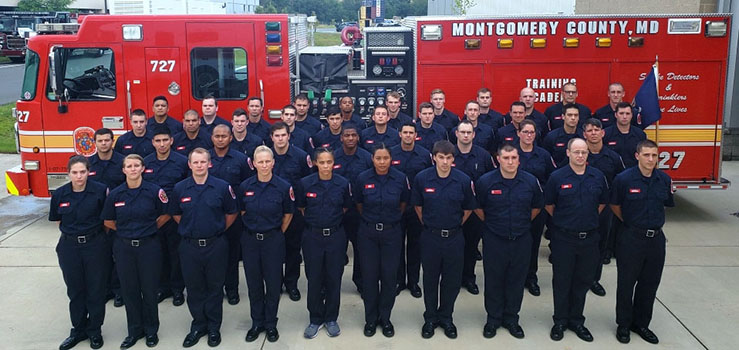
At what (x,y) coordinates should I click in order to perform the action: click on yellow lights. Please return your answer as a coordinate pair (x, y). This screenshot has width=739, height=350. Looking at the image, I should click on (272, 48), (504, 44), (539, 42), (565, 42), (607, 41).